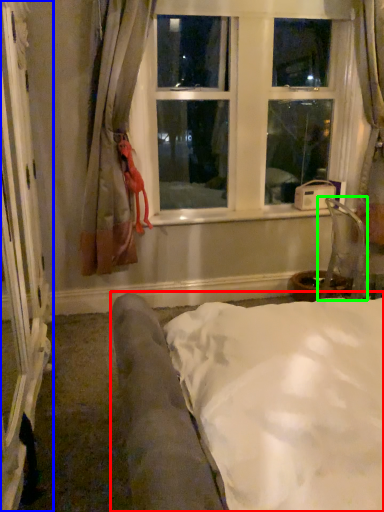
Question: Based on their relative distances, which object is farther from furniture (highlighted by a red box)? Choose from screen door (highlighted by a blue box) and armchair (highlighted by a green box).

Choices:
 (A) screen door
 (B) armchair

Answer: (B)